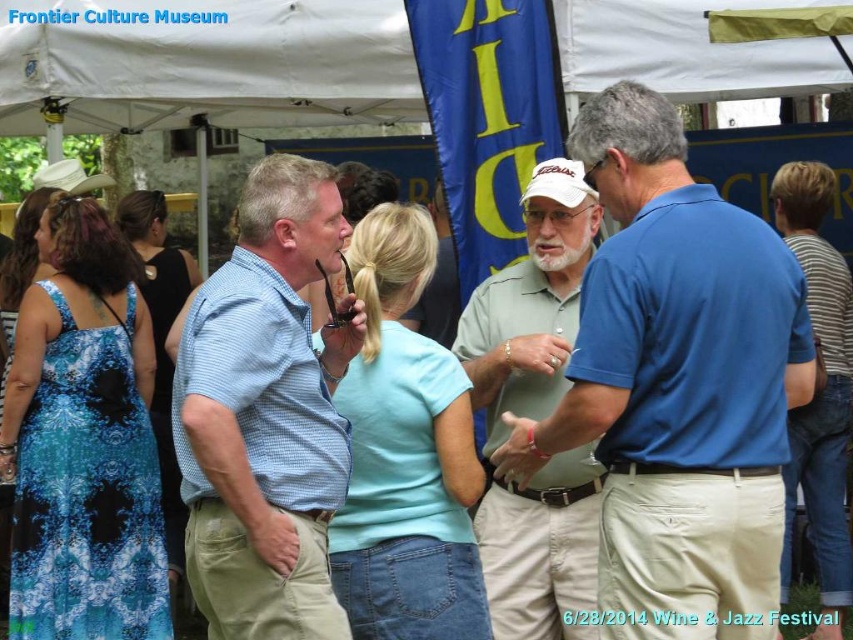
Question: Does matte blue shirt at center lie in front of blue denim jeans at right?

Choices:
 (A) yes
 (B) no

Answer: (A)

Question: Which point is farther to the camera?

Choices:
 (A) (294, 568)
 (B) (495, 582)
 (C) (837, 368)

Answer: (C)

Question: Which point is closer to the camera taking this photo?

Choices:
 (A) (836, 308)
 (B) (579, 188)
 (C) (747, 545)
 (D) (321, 228)

Answer: (C)

Question: From the image, what is the correct spatial relationship of matte blue shirt at center in relation to blue checkered shirt at center?

Choices:
 (A) left
 (B) right

Answer: (B)

Question: From the image, what is the correct spatial relationship of light green polo shirt at center in relation to blue denim jeans at right?

Choices:
 (A) above
 (B) below

Answer: (A)

Question: Which of the following is the farthest from the observer?

Choices:
 (A) [735, 257]
 (B) [549, 605]
 (C) [811, 636]
 (D) [239, 625]

Answer: (C)